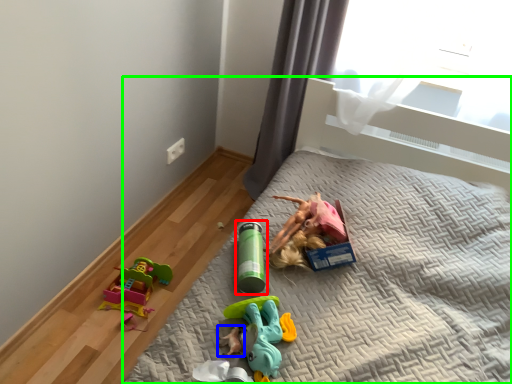
Question: Based on their relative distances, which object is farther from toy (highlighted by a red box)? Choose from toy (highlighted by a blue box) and bed (highlighted by a green box).

Choices:
 (A) toy
 (B) bed

Answer: (B)